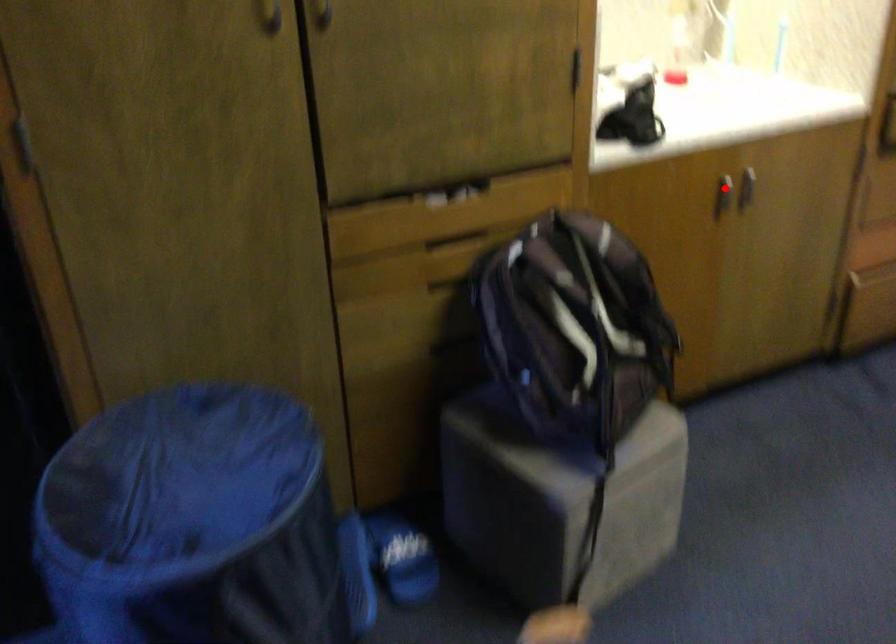
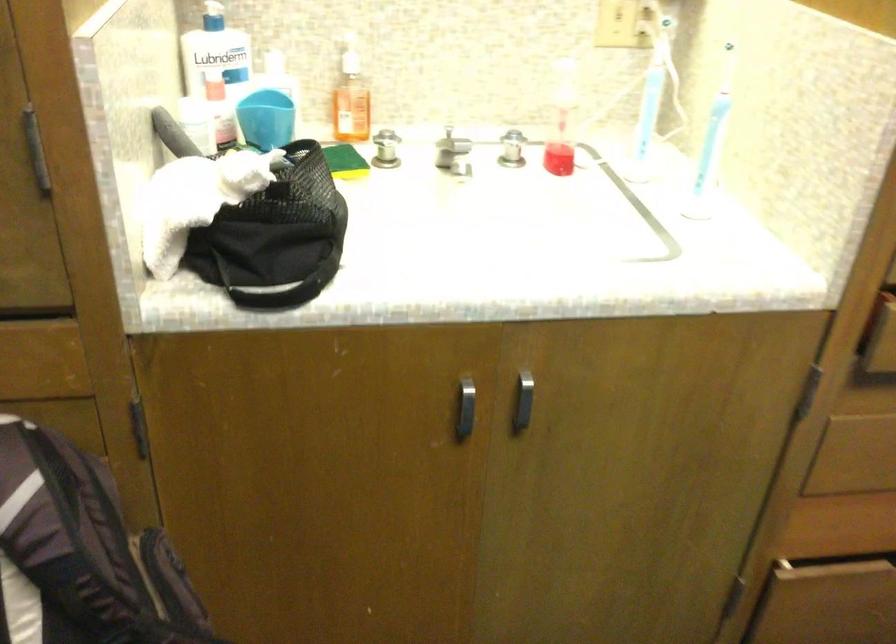
Question: I am providing you with two images of the same scene from different viewpoints. Given a red point in image1, look at the same physical point in image2. Is it:

Choices:
 (A) Closer to the viewpoint
 (B) Farther from the viewpoint

Answer: (A)